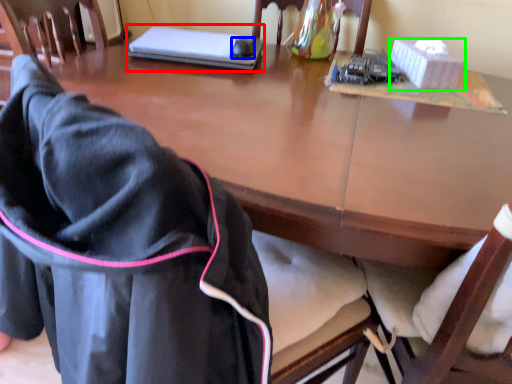
Question: Based on their relative distances, which object is nearer to laptop (highlighted by a red box)? Choose from mouse (highlighted by a blue box) and box (highlighted by a green box).

Choices:
 (A) mouse
 (B) box

Answer: (A)